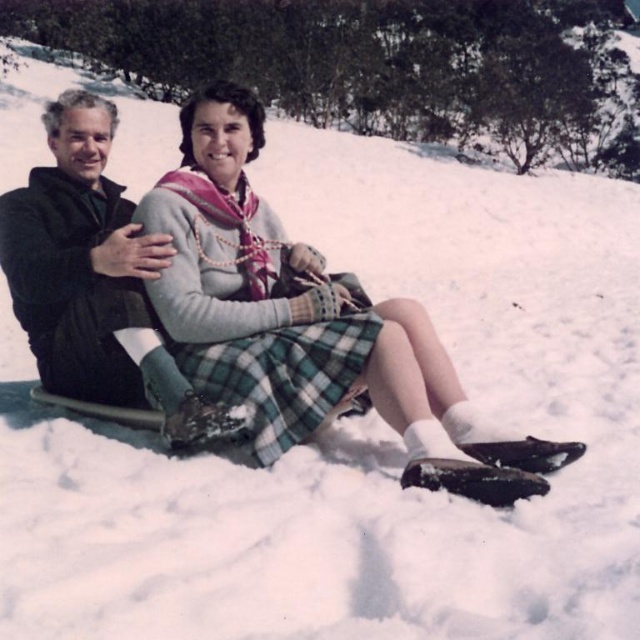
You are planning to take a photo of the two people in the snowy scene. You want to ensure both the green plaid skirt at center and the black matte jacket at left are clearly visible. Based on their positions, which one should you focus on first to ensure proper depth of field?

The green plaid skirt at center is below the black matte jacket at left. Since the black matte jacket at left is closer to the camera, you should focus on it first to ensure both are in focus.